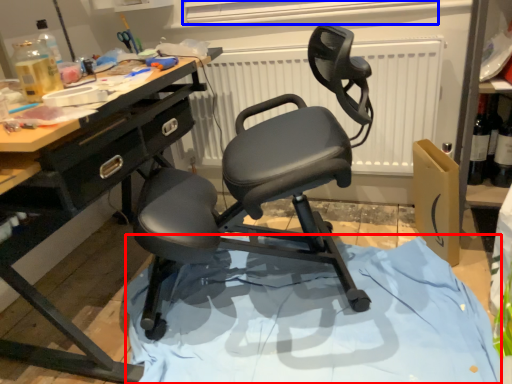
Question: Which object is further to the camera taking this photo, fabric (highlighted by a red box) or window screen (highlighted by a blue box)?

Choices:
 (A) fabric
 (B) window screen

Answer: (B)